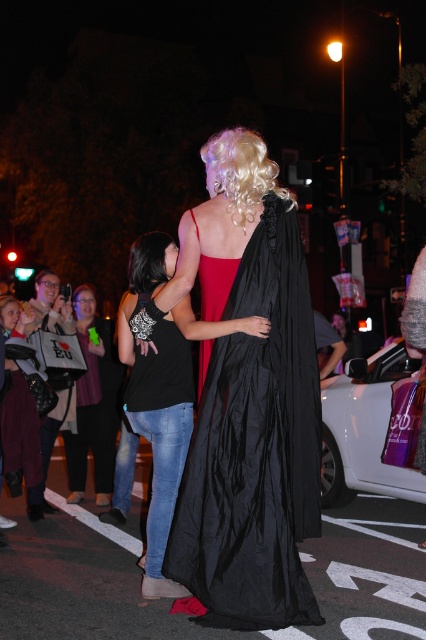
Question: Based on their relative distances, which object is farther from the white fabric bag at lower left?

Choices:
 (A) matte black cape at center
 (B) blonde curly wig at upper center
 (C) maroon fabric coat at lower left

Answer: (B)

Question: Which point is farther to the camera?

Choices:
 (A) (146, 288)
 (B) (178, 317)
 (C) (271, 163)
 (D) (37, 506)

Answer: (D)

Question: Does matte black cape at center have a smaller size compared to black silky hair at center?

Choices:
 (A) no
 (B) yes

Answer: (A)

Question: Which of the following is the farthest from the observer?

Choices:
 (A) white fabric bag at lower left
 (B) maroon fabric coat at lower left

Answer: (A)

Question: Can you confirm if blonde curly wig at upper center is positioned to the left of maroon fabric coat at lower left?

Choices:
 (A) yes
 (B) no

Answer: (B)

Question: Does blonde curly wig at upper center have a larger size compared to maroon fabric coat at lower left?

Choices:
 (A) yes
 (B) no

Answer: (B)